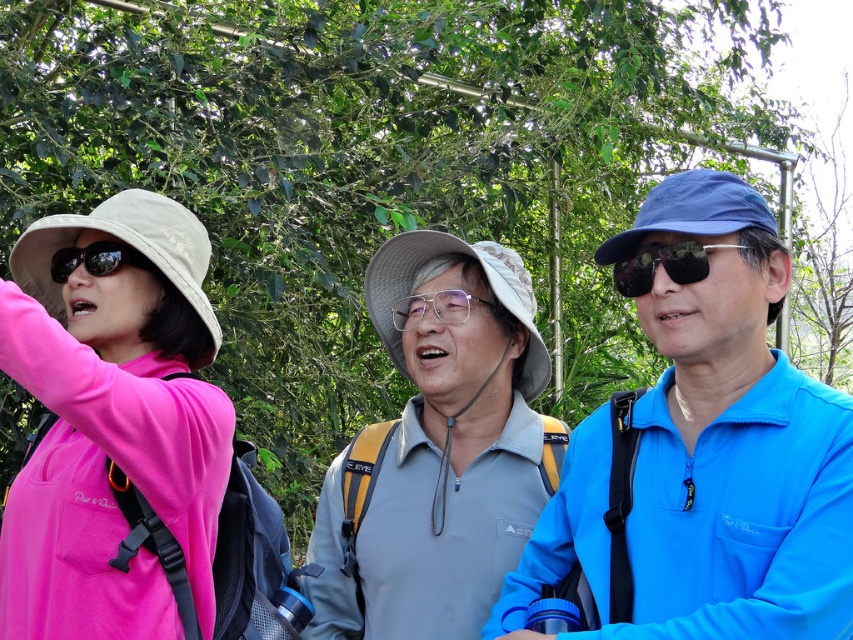
You are a photographer trying to capture a group photo of the pink matte jacket at left and the sunglasses at center. Since you want to ensure both subjects are in focus, you need to adjust your camera settings based on their sizes. Which subject should you focus on first to ensure proper depth of field?

The pink matte jacket at left is larger than the sunglasses at center, so you should focus on the pink matte jacket at left first to ensure proper depth of field.